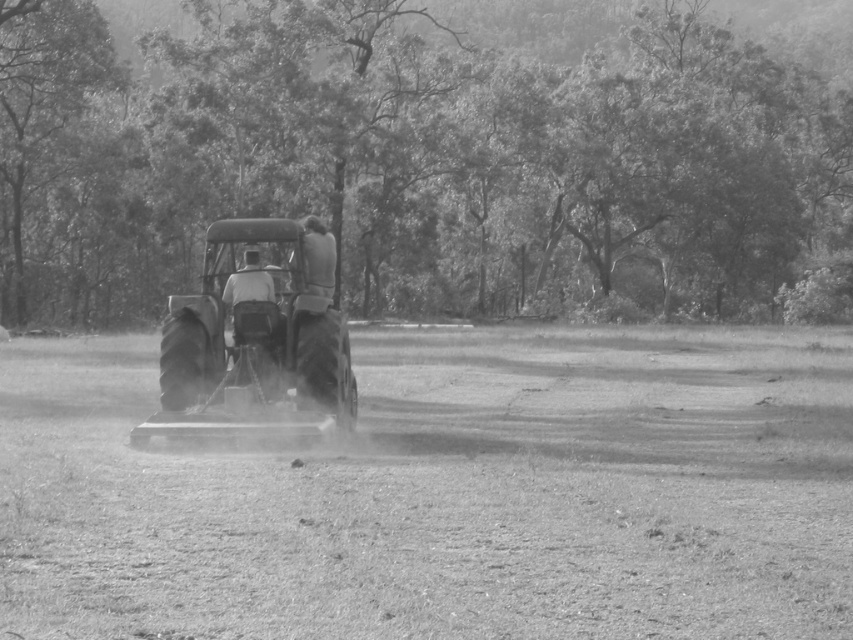
Question: Does dusty soil at center have a smaller size compared to metallic tractor at center?

Choices:
 (A) no
 (B) yes

Answer: (A)

Question: Which point is farther to the camera?

Choices:
 (A) dusty soil at center
 (B) dark gray fabric shirt at center
 (C) metallic tractor at center

Answer: (B)

Question: Is dusty soil at center to the right of metallic tractor at center from the viewer's perspective?

Choices:
 (A) yes
 (B) no

Answer: (A)

Question: Based on their relative distances, which object is nearer to the dark gray fabric shirt at center?

Choices:
 (A) dusty soil at center
 (B) metallic tractor at center

Answer: (B)

Question: Can you confirm if metallic tractor at center is smaller than dark gray fabric shirt at center?

Choices:
 (A) yes
 (B) no

Answer: (B)

Question: Which is nearer to the metallic tractor at center?

Choices:
 (A) dark gray fabric shirt at center
 (B) dusty soil at center

Answer: (A)